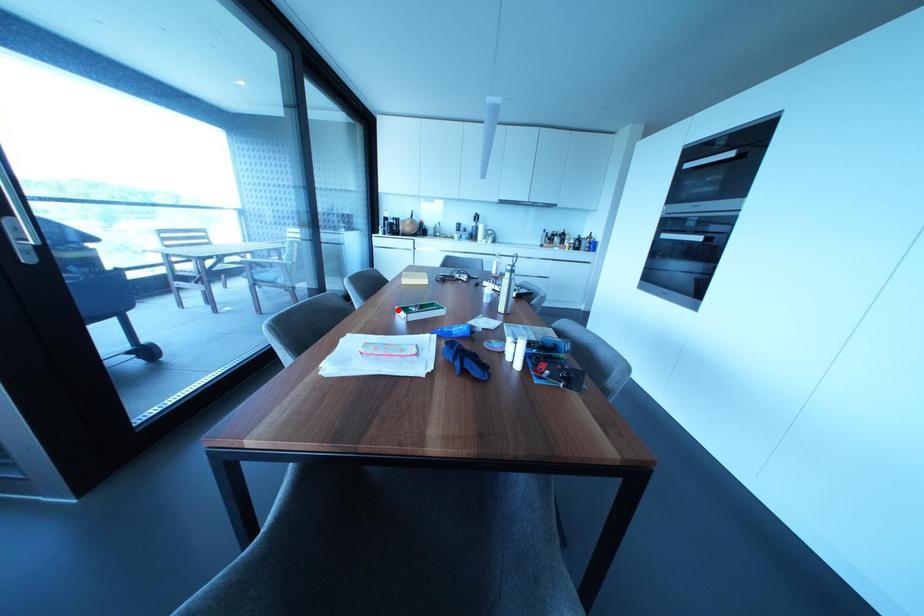
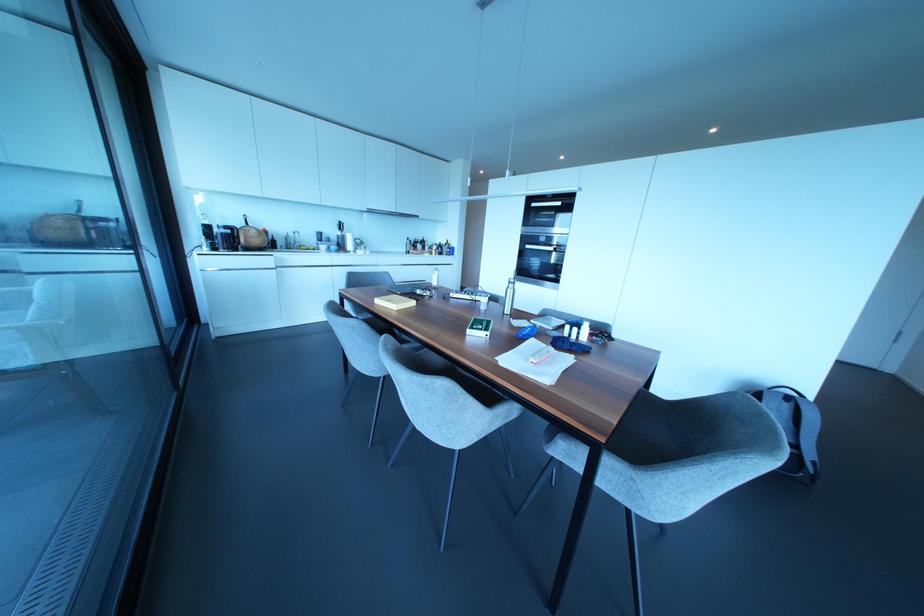
Question: I am providing you with two images of the same scene from different viewpoints. A red point is marked on the first image. Can you still see the location of the red point in image 2?

Choices:
 (A) Yes
 (B) No

Answer: (A)